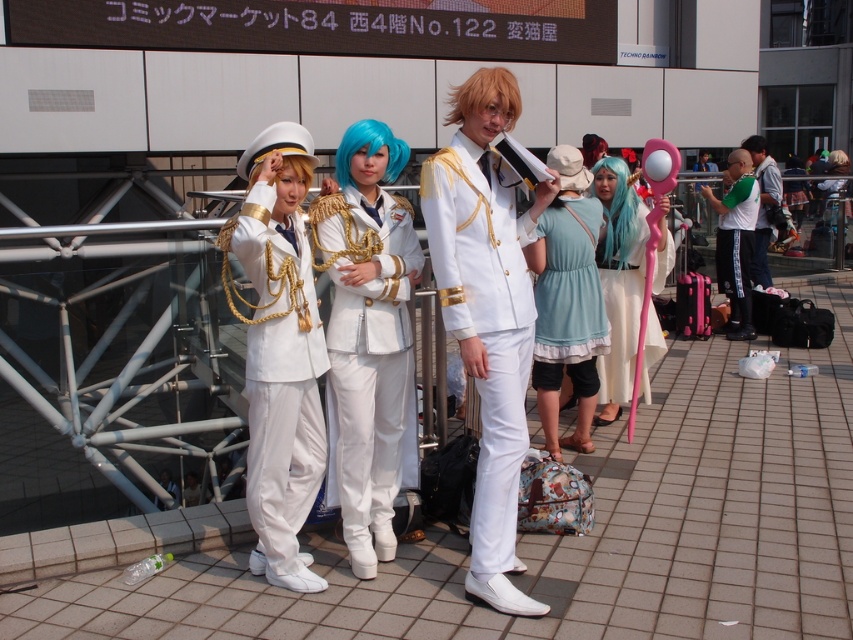
Question: Is white satin uniform at center thinner than green jersey at right?

Choices:
 (A) no
 (B) yes

Answer: (B)

Question: Which point is closer to the camera?

Choices:
 (A) white glossy uniform at center
 (B) satin white uniform at center

Answer: (B)

Question: Among these points, which one is farthest from the camera?

Choices:
 (A) (398, 195)
 (B) (590, 224)

Answer: (B)

Question: Is satin white uniform at center to the left of white glossy uniform at right from the viewer's perspective?

Choices:
 (A) no
 (B) yes

Answer: (B)

Question: Which of the following is the closest to the observer?

Choices:
 (A) satin white uniform at center
 (B) green jersey at right

Answer: (A)

Question: Does white satin uniform at center come in front of pastel blue fabric dress at center?

Choices:
 (A) yes
 (B) no

Answer: (A)